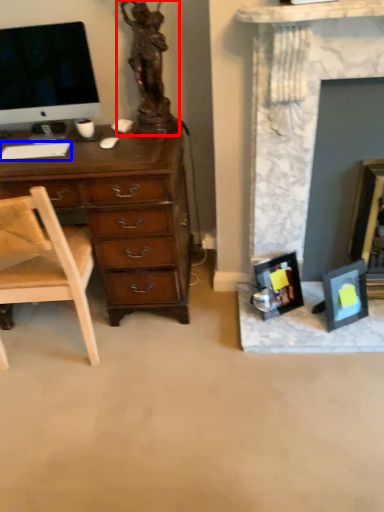
Question: Which object appears closest to the camera in this image, sculpture (highlighted by a red box) or computer keyboard (highlighted by a blue box)?

Choices:
 (A) sculpture
 (B) computer keyboard

Answer: (A)